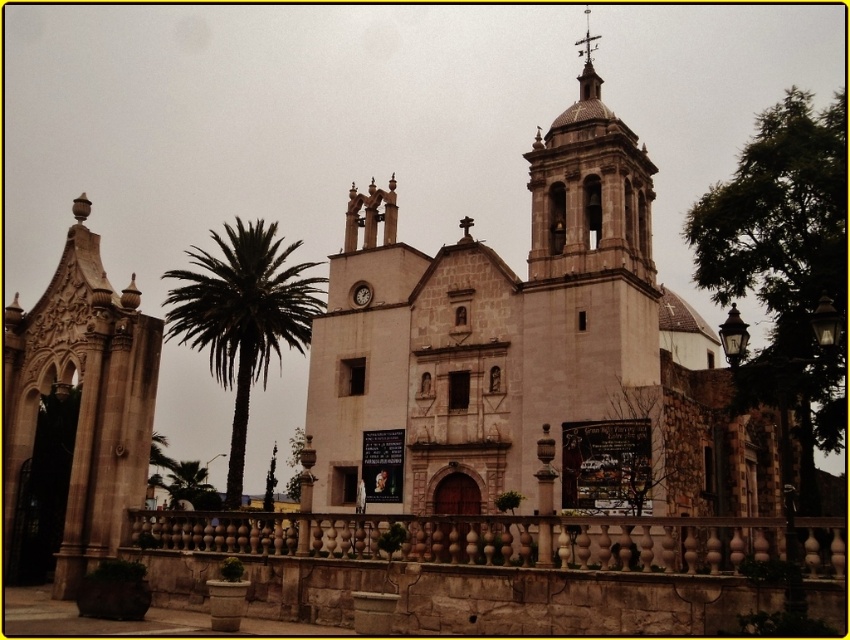
In the scene shown: You are a tour guide explaining the architecture of the church to visitors. You mention the brown stone fence at lower center and the polished copper spire at upper center. Which of these two features is wider in terms of their physical dimensions?

The brown stone fence at lower center is wider than the polished copper spire at upper center according to the description.

You are a tourist standing in front of the historic church and notice the green leafy palm tree at center and the polished copper spire at upper center. Which object is located higher in the image?

The polished copper spire at upper center is located higher in the image than the green leafy palm tree at center.